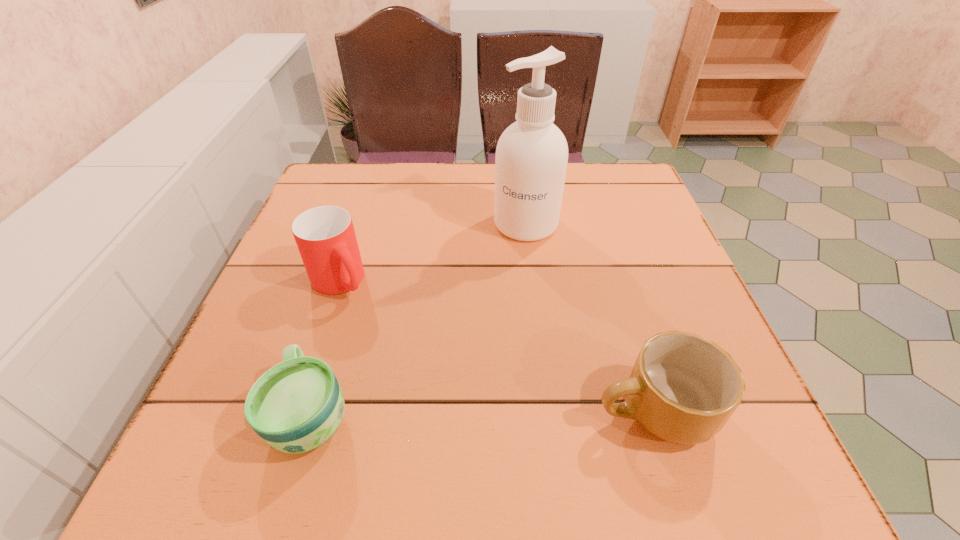
I want to click on the nearer cup, so click(296, 406).

Identify the location of mug. (683, 388).

Locate an element on the screen. cleansing agent is located at coordinates (531, 159).

You are a GUI agent. You are given a task and a screenshot of the screen. Output one action in this format:
    pyautogui.click(x=<x>, y=<y>)
    Task: Click on the tallest object
    The image size is (960, 540).
    Given the screenshot: What is the action you would take?
    pyautogui.click(x=531, y=159)

Locate an element on the screen. The image size is (960, 540). the third shortest object is located at coordinates (325, 236).

Identify the location of the taller cup. The width and height of the screenshot is (960, 540). (325, 236).

At what (x,y) coordinates should I click in order to perform the action: click on vacant region located 0.400m on the back of the shorter cup. Please return your answer as a coordinate pair (x, y). Image resolution: width=960 pixels, height=540 pixels. Looking at the image, I should click on (367, 230).

Find the location of a particular element. This screenshot has width=960, height=540. free point located on the side with the handle of the mug is located at coordinates (396, 410).

Find the location of a particular element. free location located 0.170m on the side with the handle of the mug is located at coordinates coord(488,410).

Locate an element on the screen. The width and height of the screenshot is (960, 540). vacant area situated 0.170m on the side with the handle of the mug is located at coordinates (488, 410).